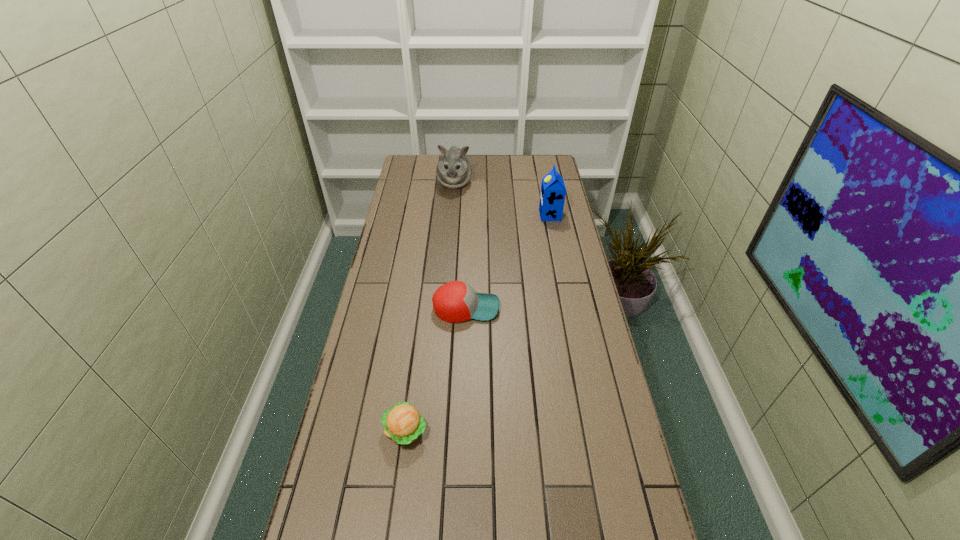
At what (x,y) coordinates should I click in order to perform the action: click on vacant space that satisfies the following two spatial constraints: 1. with the cap open on the rightmost object; 2. on the front side of the hamburger. Please return your answer as a coordinate pair (x, y). Looking at the image, I should click on (593, 431).